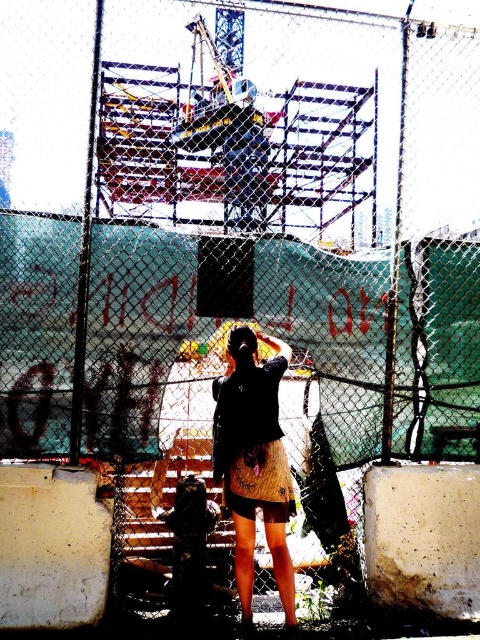
Question: Among these points, which one is nearest to the camera?

Choices:
 (A) (229, 428)
 (B) (253, 540)

Answer: (B)

Question: Is matte black shirt at center wider than wooden skirt at center?

Choices:
 (A) no
 (B) yes

Answer: (B)

Question: Can you confirm if matte black shirt at center is bigger than wooden skirt at center?

Choices:
 (A) yes
 (B) no

Answer: (A)

Question: Is matte black shirt at center positioned in front of wooden skirt at center?

Choices:
 (A) yes
 (B) no

Answer: (A)